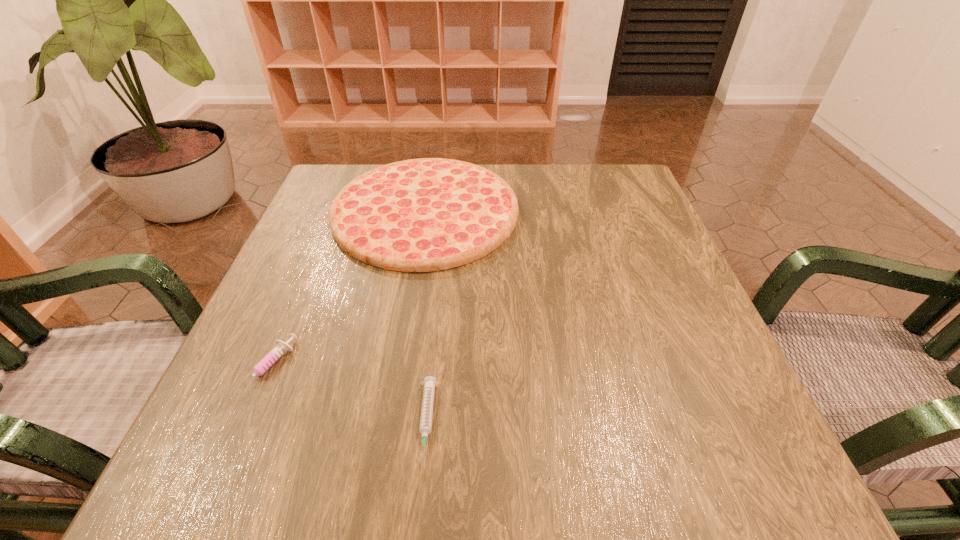
This screenshot has width=960, height=540. In order to click on pizza in this screenshot , I will do `click(419, 215)`.

Where is `the tallest object`? This screenshot has width=960, height=540. the tallest object is located at coordinates pos(419,215).

The width and height of the screenshot is (960, 540). Find the location of `the left syringe`. the left syringe is located at coordinates (281, 348).

Locate an element on the screen. This screenshot has width=960, height=540. the right syringe is located at coordinates (429, 383).

Locate an element on the screen. The height and width of the screenshot is (540, 960). vacant space situated on the right of the pizza is located at coordinates (654, 211).

Where is `vacant area located 0.060m on the front of the left syringe`? vacant area located 0.060m on the front of the left syringe is located at coordinates (237, 442).

Locate an element on the screen. This screenshot has height=540, width=960. object positioned at the far edge is located at coordinates (419, 215).

The height and width of the screenshot is (540, 960). Identify the location of object at the near edge. (429, 383).

This screenshot has width=960, height=540. What are the coordinates of `pizza present at the left edge` in the screenshot? It's located at (419, 215).

This screenshot has height=540, width=960. Identify the location of syringe located in the left edge section of the desktop. (281, 348).